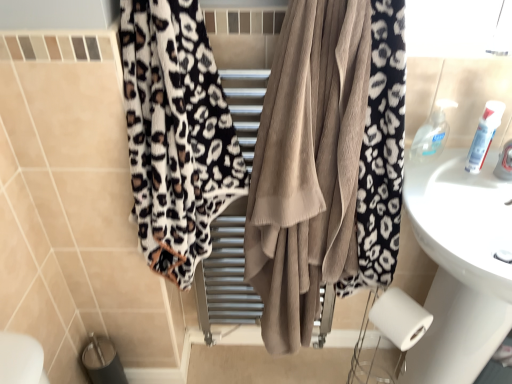
Question: Does leopard print fabric at left, positioned as the second curtain in right-to-left order, have a greater width compared to leopard print towel at center, the 2th curtain viewed from the left?

Choices:
 (A) no
 (B) yes

Answer: (B)

Question: From the image's perspective, is leopard print fabric at left, which appears as the first curtain when viewed from the left, on top of leopard print towel at center, the 2th curtain viewed from the left?

Choices:
 (A) yes
 (B) no

Answer: (A)

Question: Can you confirm if leopard print fabric at left, which appears as the first curtain when viewed from the left, is thinner than leopard print towel at center, the 2th curtain viewed from the left?

Choices:
 (A) yes
 (B) no

Answer: (B)

Question: From the image's perspective, is leopard print fabric at left, which appears as the first curtain when viewed from the left, beneath leopard print towel at center, which is the first curtain in right-to-left order?

Choices:
 (A) yes
 (B) no

Answer: (B)

Question: From a real-world perspective, is leopard print fabric at left, positioned as the second curtain in right-to-left order, over leopard print towel at center, which is the first curtain in right-to-left order?

Choices:
 (A) yes
 (B) no

Answer: (A)

Question: Looking at their shapes, would you say clear plastic soap dispenser at upper right, the first toiletry viewed from the left, is wider or thinner than leopard print fabric at left, positioned as the second curtain in right-to-left order?

Choices:
 (A) thin
 (B) wide

Answer: (A)

Question: Based on their sizes in the image, would you say clear plastic soap dispenser at upper right, the first toiletry viewed from the left, is bigger or smaller than leopard print fabric at left, which appears as the first curtain when viewed from the left?

Choices:
 (A) big
 (B) small

Answer: (B)

Question: From a real-world perspective, relative to leopard print fabric at left, which appears as the first curtain when viewed from the left, is clear plastic soap dispenser at upper right, the second toiletry when ordered from right to left, vertically above or below?

Choices:
 (A) below
 (B) above

Answer: (A)

Question: Is clear plastic soap dispenser at upper right, the first toiletry viewed from the left, taller or shorter than leopard print fabric at left, which appears as the first curtain when viewed from the left?

Choices:
 (A) short
 (B) tall

Answer: (A)

Question: Choose the correct answer: Is leopard print fabric at left, positioned as the second curtain in right-to-left order, inside clear plastic soap dispenser at upper right, the first toiletry viewed from the left, or outside it?

Choices:
 (A) outside
 (B) inside

Answer: (A)

Question: Is leopard print fabric at left, which appears as the first curtain when viewed from the left, in front of or behind clear plastic soap dispenser at upper right, the first toiletry viewed from the left, in the image?

Choices:
 (A) behind
 (B) front

Answer: (B)

Question: Looking at the image, does leopard print fabric at left, which appears as the first curtain when viewed from the left, seem bigger or smaller compared to clear plastic soap dispenser at upper right, the second toiletry when ordered from right to left?

Choices:
 (A) big
 (B) small

Answer: (A)

Question: In terms of width, does leopard print fabric at left, which appears as the first curtain when viewed from the left, look wider or thinner when compared to clear plastic soap dispenser at upper right, the first toiletry viewed from the left?

Choices:
 (A) wide
 (B) thin

Answer: (A)

Question: Which is correct: leopard print towel at center, which is the first curtain in right-to-left order, is inside white glossy tube at upper right, the 1th toiletry positioned from the right, or outside of it?

Choices:
 (A) inside
 (B) outside

Answer: (B)

Question: Is point (248, 218) positioned closer to the camera than point (487, 109)?

Choices:
 (A) farther
 (B) closer

Answer: (A)